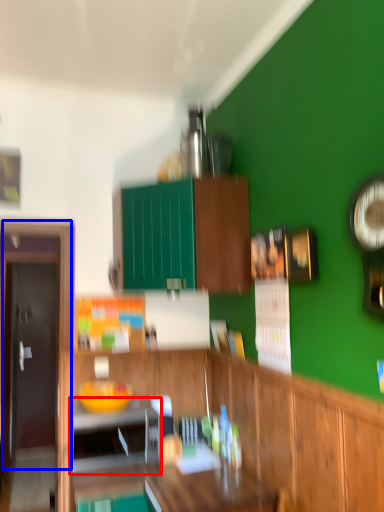
Question: Among these objects, which one is farthest to the camera, appliance (highlighted by a red box) or door (highlighted by a blue box)?

Choices:
 (A) appliance
 (B) door

Answer: (B)